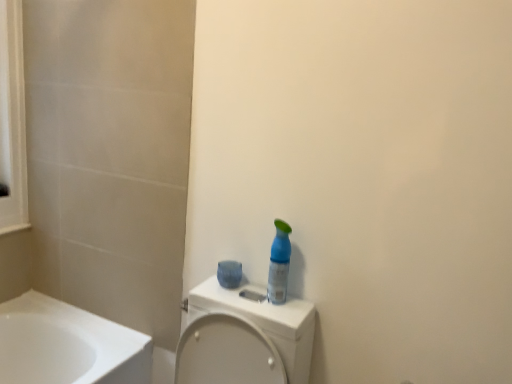
Find the location of a particular element. The image size is (512, 384). vacant area to the left of transparent plastic spray bottle at center is located at coordinates (234, 295).